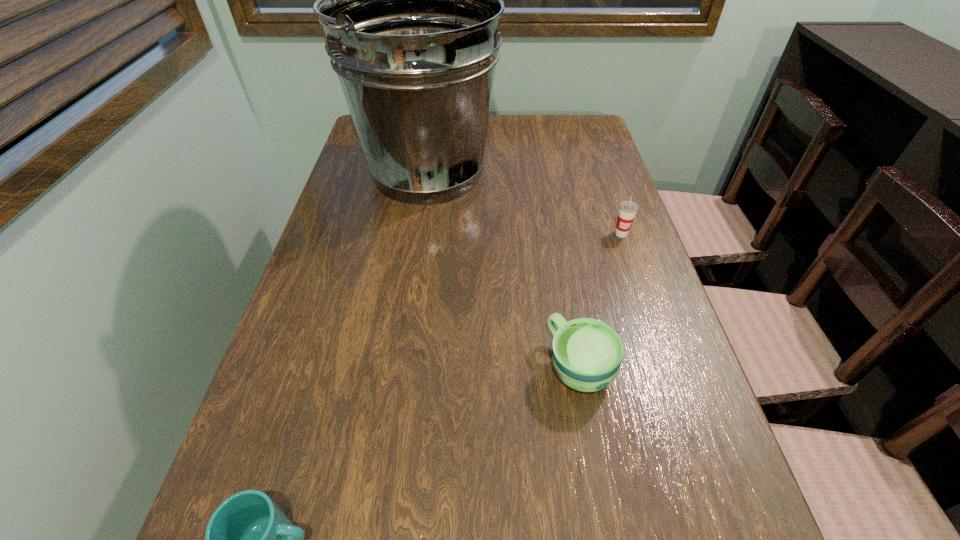
Locate an element on the screen. The height and width of the screenshot is (540, 960). object located at the left edge is located at coordinates (410, 0).

Locate an element on the screen. The width and height of the screenshot is (960, 540). object at the far left corner is located at coordinates (410, 0).

At what (x,y) coordinates should I click in order to perform the action: click on vacant space at the far edge. Please return your answer as a coordinate pair (x, y). Looking at the image, I should click on (525, 125).

The height and width of the screenshot is (540, 960). Find the location of `blank area at the left edge`. blank area at the left edge is located at coordinates (297, 347).

The image size is (960, 540). In order to click on free location at the right edge of the desktop in this screenshot , I will do `click(612, 202)`.

Identify the location of free area in between the second farthest cup and the tallest object. (503, 269).

Where is `blank region between the third farthest object and the farthest cup`? Image resolution: width=960 pixels, height=540 pixels. blank region between the third farthest object and the farthest cup is located at coordinates (600, 300).

Locate an element on the screen. The height and width of the screenshot is (540, 960). free space between the third farthest object and the farthest object is located at coordinates (503, 269).

This screenshot has width=960, height=540. Find the location of `free space between the farthest object and the farthest cup`. free space between the farthest object and the farthest cup is located at coordinates (524, 202).

Identify the location of vacant region between the tallest object and the rightmost object. This screenshot has height=540, width=960. (524, 202).